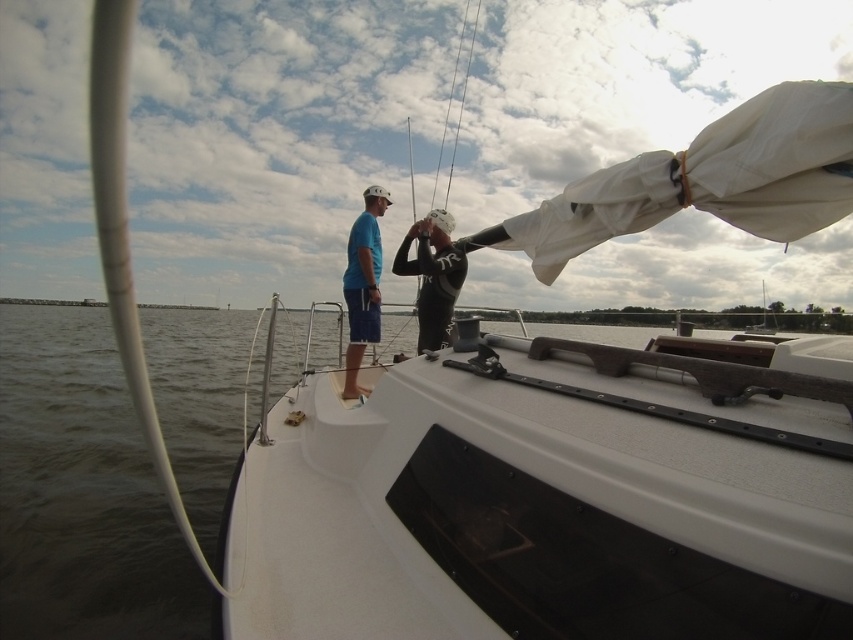
You are a sailor on the deck of the sailboat and need to place a 1.2 meter wide crate between the transparent water at center and the matte blue shorts at center. Can the crate fit between them?

The transparent water at center is wider than the matte blue shorts at center. However, the exact widths are not provided, so it is uncertain if the 1.2 meter crate can fit between them.

You are a sailor on the boat and need to store your gear. You have a transparent water at center and a black rubber wetsuit at center. Which item takes up more space on the deck?

The transparent water at center is bigger than the black rubber wetsuit at center, so the transparent water at center takes up more space on the deck.

From the picture: You are on a sailboat and need to determine which of the two points, point (352, 449) or point (357, 328), is closer to you. Based on the scene description, which point should you approach first?

Point (352, 449) is closer to the viewer than point (357, 328), so you should approach point (352, 449) first.